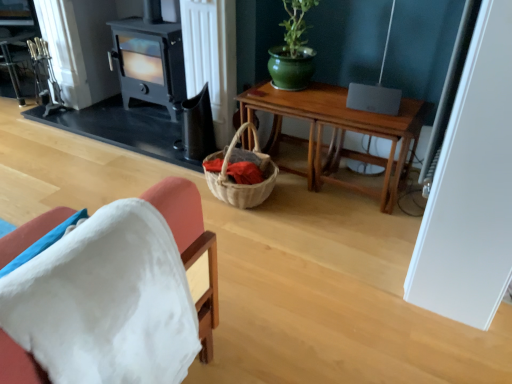
Question: From the image's perspective, is white fabric chair at lower left beneath wooden table at center?

Choices:
 (A) no
 (B) yes

Answer: (B)

Question: Is white fabric chair at lower left not near wooden table at center?

Choices:
 (A) yes
 (B) no

Answer: (A)

Question: Can you confirm if white fabric chair at lower left is wider than wooden table at center?

Choices:
 (A) yes
 (B) no

Answer: (B)

Question: Could you tell me if white fabric chair at lower left is facing wooden table at center?

Choices:
 (A) no
 (B) yes

Answer: (A)

Question: Is white fabric chair at lower left surrounding wooden table at center?

Choices:
 (A) yes
 (B) no

Answer: (B)

Question: From a real-world perspective, is wooden table at center above or below black matte fireplace at center?

Choices:
 (A) below
 (B) above

Answer: (A)

Question: Based on their positions, is wooden table at center located to the left or right of black matte fireplace at center?

Choices:
 (A) left
 (B) right

Answer: (B)

Question: Does point (371, 127) appear closer or farther from the camera than point (157, 38)?

Choices:
 (A) farther
 (B) closer

Answer: (B)

Question: In the image, is wooden table at center positioned in front of or behind black matte fireplace at center?

Choices:
 (A) behind
 (B) front

Answer: (B)

Question: From their relative heights in the image, would you say wooden table at center is taller or shorter than white fabric chair at lower left?

Choices:
 (A) short
 (B) tall

Answer: (A)

Question: Is point (256, 105) positioned closer to the camera than point (193, 215)?

Choices:
 (A) farther
 (B) closer

Answer: (A)

Question: From the image's perspective, is wooden table at center located above or below white fabric chair at lower left?

Choices:
 (A) below
 (B) above

Answer: (B)

Question: Is wooden table at center inside the boundaries of white fabric chair at lower left, or outside?

Choices:
 (A) inside
 (B) outside

Answer: (B)

Question: In terms of size, does black matte fireplace at center appear bigger or smaller than white fabric chair at lower left?

Choices:
 (A) big
 (B) small

Answer: (A)

Question: In the image, is black matte fireplace at center on the left side or the right side of white fabric chair at lower left?

Choices:
 (A) right
 (B) left

Answer: (B)